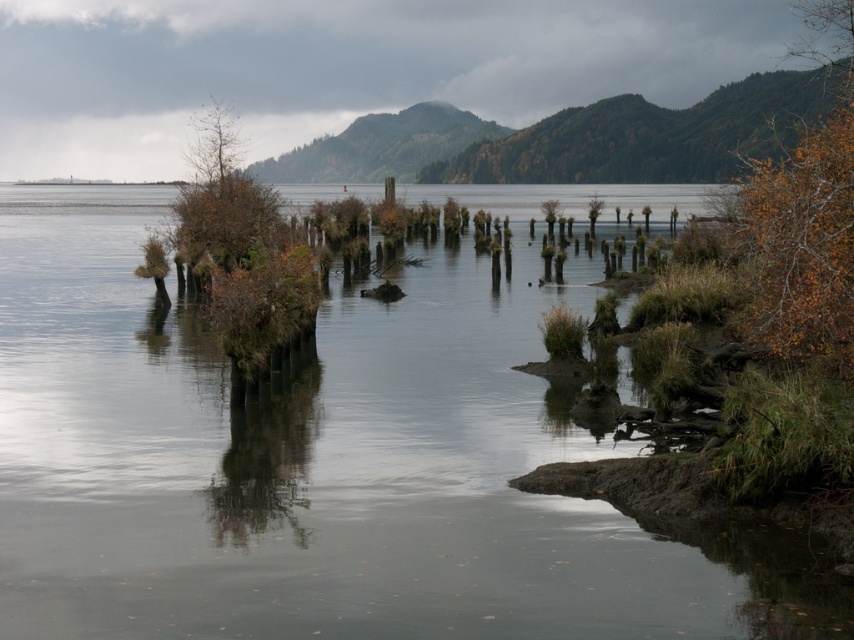
Can you confirm if clear water at center is positioned to the right of brown matte tree at upper left?

Indeed, clear water at center is positioned on the right side of brown matte tree at upper left.

This screenshot has height=640, width=854. Identify the location of clear water at center. [x=329, y=458].

Describe the element at coordinates (329, 458) in the screenshot. Image resolution: width=854 pixels, height=640 pixels. I see `clear water at center` at that location.

Where is `clear water at center`? The image size is (854, 640). clear water at center is located at coordinates (329, 458).

Is clear water at center thinner than brown rough tree at center?

Incorrect, clear water at center's width is not less than brown rough tree at center's.

Which is above, clear water at center or brown rough tree at center?

brown rough tree at center is higher up.

Is point (189, 408) positioned behind point (595, 200)?

No.

Locate an element on the screen. The image size is (854, 640). clear water at center is located at coordinates (329, 458).

Can you confirm if brown matte tree at upper left is taller than brown rough tree at center?

Indeed, brown matte tree at upper left has a greater height compared to brown rough tree at center.

Does brown matte tree at upper left lie behind brown rough tree at center?

No.

Is point (230, 262) farther from viewer compared to point (591, 225)?

No, (230, 262) is in front of (591, 225).

At what (x,y) coordinates should I click in order to perform the action: click on brown matte tree at upper left. Please return your answer as a coordinate pair (x, y). This screenshot has height=640, width=854. Looking at the image, I should click on (221, 198).